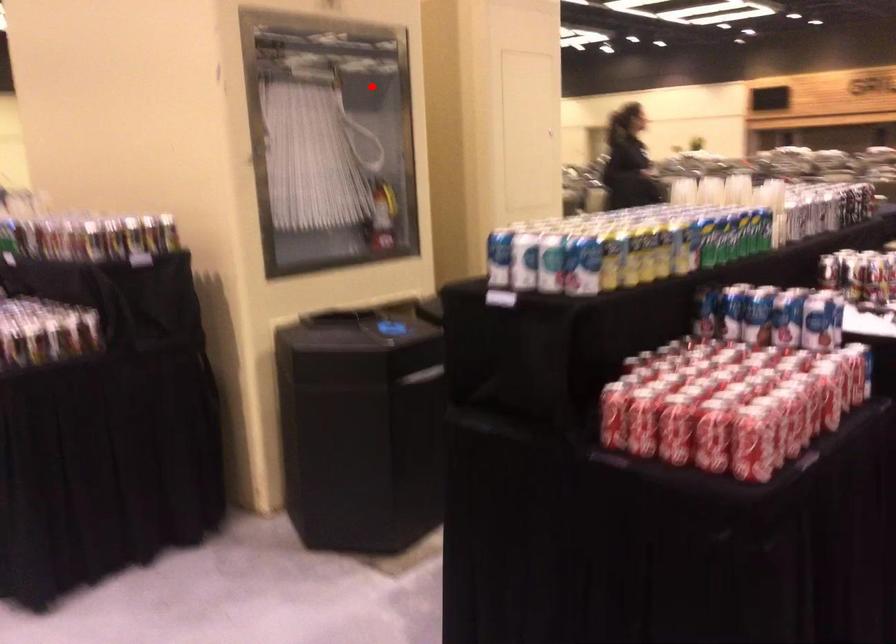
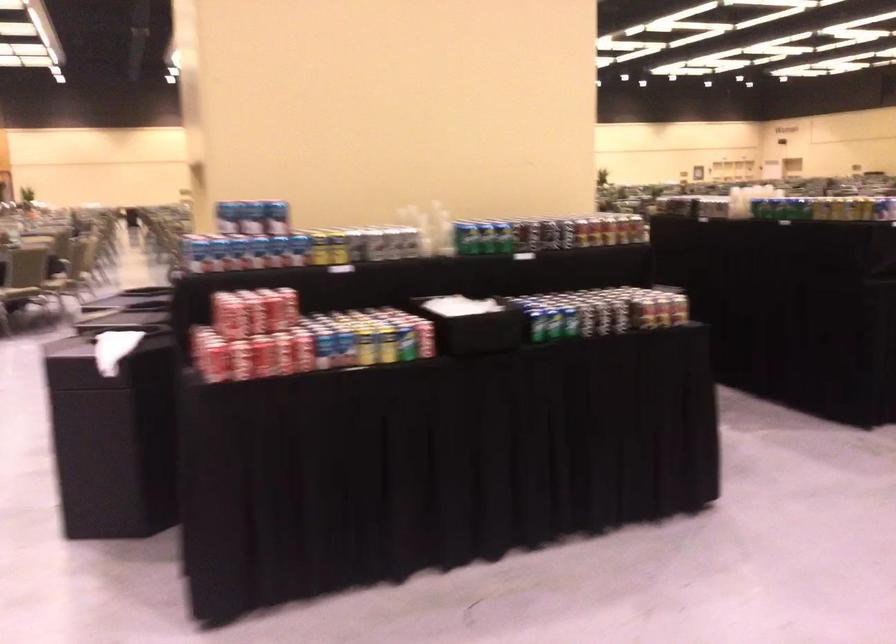
Question: I am providing you with two images of the same scene from different viewpoints. A red point is marked on the first image. Can you still see the location of the red point in image 2?

Choices:
 (A) Yes
 (B) No

Answer: (B)